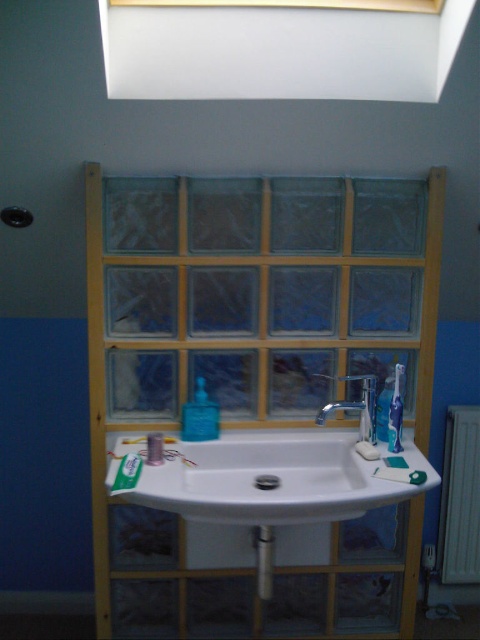
You are a bathroom designer planning to place a new decorative item on the bathroom counter. The item requires a space that is at least as tall as the green matte toothpaste at lower left. Can the white ceramic sink at center provide enough vertical space for this item?

The white ceramic sink at center is taller than the green matte toothpaste at lower left, so it can provide sufficient vertical space for the decorative item requiring at least the height of the green matte toothpaste at lower left.